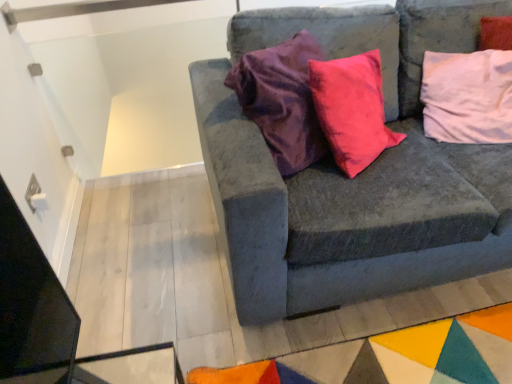
What do you see at coordinates (468, 97) in the screenshot? The height and width of the screenshot is (384, 512). I see `pink fabric pillow at upper right` at bounding box center [468, 97].

From the picture: What is the approximate height of pink fabric pillow at upper right?

The height of pink fabric pillow at upper right is 57.85 centimeters.

What is the approximate width of pink fabric pillow at upper right?

The width of pink fabric pillow at upper right is 14.46 inches.

You are a GUI agent. You are given a task and a screenshot of the screen. Output one action in this format:
    pyautogui.click(x=<x>, y=<y>)
    Task: Click on the pink fabric pillow at upper right
    
    Given the screenshot: What is the action you would take?
    pyautogui.click(x=468, y=97)

This screenshot has width=512, height=384. What are the coordinates of `velvet gray couch at center` in the screenshot? It's located at (354, 178).

Measure the distance between velvet gray couch at center and camera.

The depth of velvet gray couch at center is 3.72 feet.

What do you see at coordinates (354, 178) in the screenshot?
I see `velvet gray couch at center` at bounding box center [354, 178].

You are a GUI agent. You are given a task and a screenshot of the screen. Output one action in this format:
    pyautogui.click(x=<x>, y=<y>)
    Task: Click on the pink fabric pillow at upper right
    
    Given the screenshot: What is the action you would take?
    pyautogui.click(x=468, y=97)

Is velvet gray couch at center at the right side of pink fabric pillow at upper right?

Incorrect, velvet gray couch at center is not on the right side of pink fabric pillow at upper right.

Between velvet gray couch at center and pink fabric pillow at upper right, which one is positioned behind?

pink fabric pillow at upper right is behind.

Is point (313, 181) in front of point (486, 95)?

Yes, it is in front of point (486, 95).

From the image's perspective, is velvet gray couch at center located beneath pink fabric pillow at upper right?

Yes, from the image's perspective, velvet gray couch at center is below pink fabric pillow at upper right.

From a real-world perspective, which object stands above the other?

pink fabric pillow at upper right, from a real-world perspective.

Which of these two, velvet gray couch at center or pink fabric pillow at upper right, is wider?

velvet gray couch at center is wider.

In the scene shown: Is velvet gray couch at center taller or shorter than pink fabric pillow at upper right?

In the image, velvet gray couch at center appears to be taller than pink fabric pillow at upper right.

Consider the image. Can you confirm if velvet gray couch at center is smaller than pink fabric pillow at upper right?

Actually, velvet gray couch at center might be larger than pink fabric pillow at upper right.

Can pink fabric pillow at upper right be found inside velvet gray couch at center?

Yes, pink fabric pillow at upper right is inside velvet gray couch at center.

Would you consider velvet gray couch at center to be distant from pink fabric pillow at upper right?

No, velvet gray couch at center is not far away from pink fabric pillow at upper right.

Is velvet gray couch at center oriented towards pink fabric pillow at upper right?

Yes, velvet gray couch at center is turned towards pink fabric pillow at upper right.

What's the angular difference between velvet gray couch at center and pink fabric pillow at upper right's facing directions?

The angle between the facing direction of velvet gray couch at center and the facing direction of pink fabric pillow at upper right is 37.4 degrees.

At what (x,y) coordinates should I click in order to perform the action: click on pillow on the right of velvet gray couch at center. Please return your answer as a coordinate pair (x, y). Looking at the image, I should click on (468, 97).

Considering the relative positions of pink fabric pillow at upper right and velvet gray couch at center in the image provided, is pink fabric pillow at upper right to the right of velvet gray couch at center from the viewer's perspective?

Correct, you'll find pink fabric pillow at upper right to the right of velvet gray couch at center.

Between pink fabric pillow at upper right and velvet gray couch at center, which one is positioned behind?

pink fabric pillow at upper right is further from the camera.

Is point (472, 68) closer or farther from the camera than point (371, 173)?

Point (472, 68).

From the image's perspective, which one is positioned higher, pink fabric pillow at upper right or velvet gray couch at center?

pink fabric pillow at upper right is shown above in the image.

From a real-world perspective, which is physically below, pink fabric pillow at upper right or velvet gray couch at center?

velvet gray couch at center, from a real-world perspective.

Considering the relative sizes of pink fabric pillow at upper right and velvet gray couch at center in the image provided, is pink fabric pillow at upper right thinner than velvet gray couch at center?

Yes.

Does pink fabric pillow at upper right have a greater height compared to velvet gray couch at center?

In fact, pink fabric pillow at upper right may be shorter than velvet gray couch at center.

Who is bigger, pink fabric pillow at upper right or velvet gray couch at center?

velvet gray couch at center.

Is pink fabric pillow at upper right inside or outside of velvet gray couch at center?

pink fabric pillow at upper right is contained in velvet gray couch at center.

Is pink fabric pillow at upper right far away from velvet gray couch at center?

No, there isn't a large distance between pink fabric pillow at upper right and velvet gray couch at center.

Could you tell me if pink fabric pillow at upper right is facing velvet gray couch at center?

Yes, pink fabric pillow at upper right is oriented towards velvet gray couch at center.

How many degrees apart are the facing directions of pink fabric pillow at upper right and velvet gray couch at center?

37.4 degrees.

Locate an element on the screen. The height and width of the screenshot is (384, 512). pillow lying above the velvet gray couch at center (from the image's perspective) is located at coordinates (468, 97).

You are a GUI agent. You are given a task and a screenshot of the screen. Output one action in this format:
    pyautogui.click(x=<x>, y=<y>)
    Task: Click on the pillow behind the velvet gray couch at center
    The image size is (512, 384).
    Given the screenshot: What is the action you would take?
    pyautogui.click(x=468, y=97)

Locate an element on the screen. This screenshot has height=384, width=512. pillow on the right side of velvet gray couch at center is located at coordinates (468, 97).